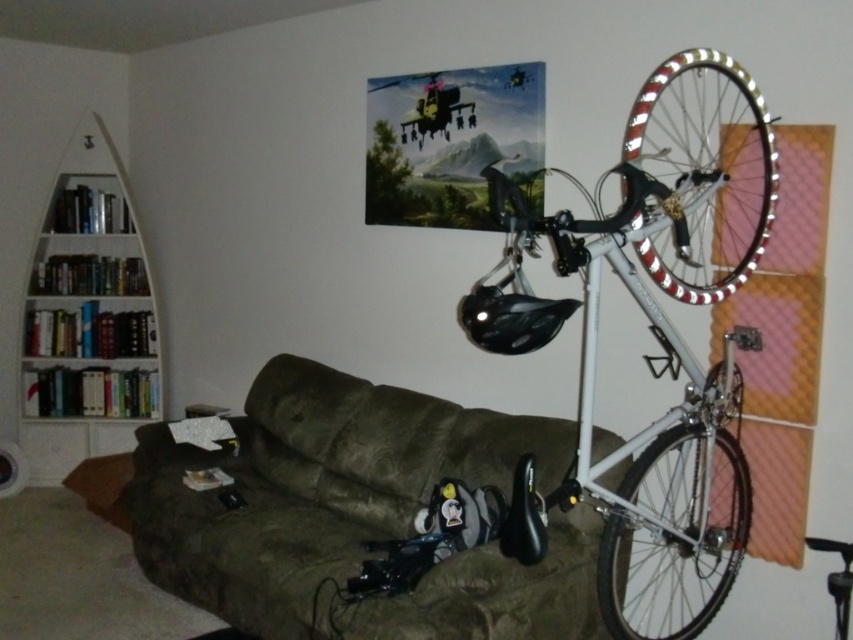
This screenshot has height=640, width=853. What are the coordinates of `brown suede couch at lower center` in the screenshot? It's located at (315, 486).

Can you confirm if brown suede couch at lower center is shorter than white metallic wheel at upper right?

In fact, brown suede couch at lower center may be taller than white metallic wheel at upper right.

Identify the location of brown suede couch at lower center. (315, 486).

Locate an element on the screen. brown suede couch at lower center is located at coordinates (315, 486).

Does white wooden bookshelf at left have a greater width compared to white metallic bicycle wheel at right?

Correct, the width of white wooden bookshelf at left exceeds that of white metallic bicycle wheel at right.

The height and width of the screenshot is (640, 853). What do you see at coordinates (86, 316) in the screenshot?
I see `white wooden bookshelf at left` at bounding box center [86, 316].

The image size is (853, 640). In order to click on white wooden bookshelf at left in this screenshot , I will do pyautogui.click(x=86, y=316).

Between brown suede couch at lower center and white metallic bicycle wheel at right, which one has less height?

Standing shorter between the two is white metallic bicycle wheel at right.

Is point (384, 508) closer to viewer compared to point (604, 564)?

No, it is behind (604, 564).

I want to click on brown suede couch at lower center, so click(315, 486).